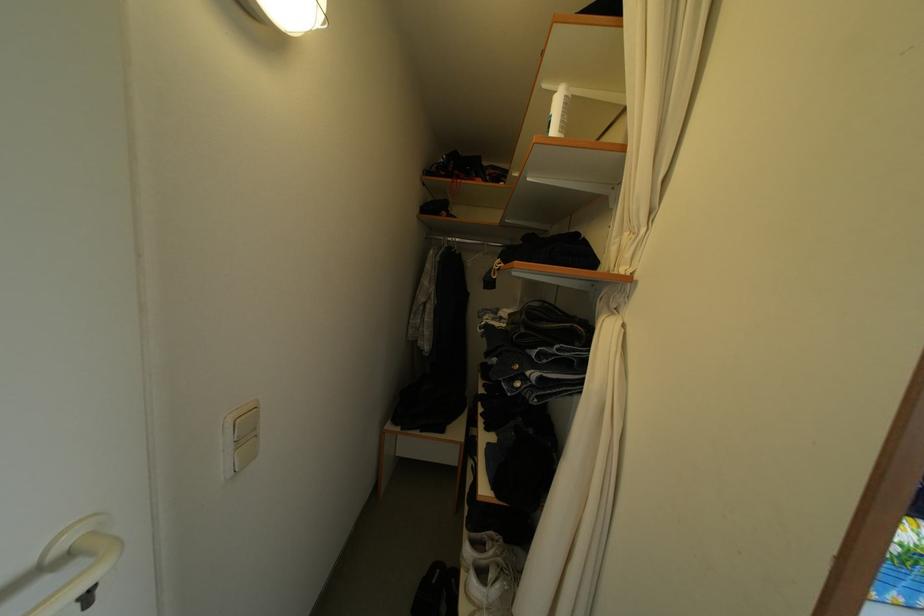
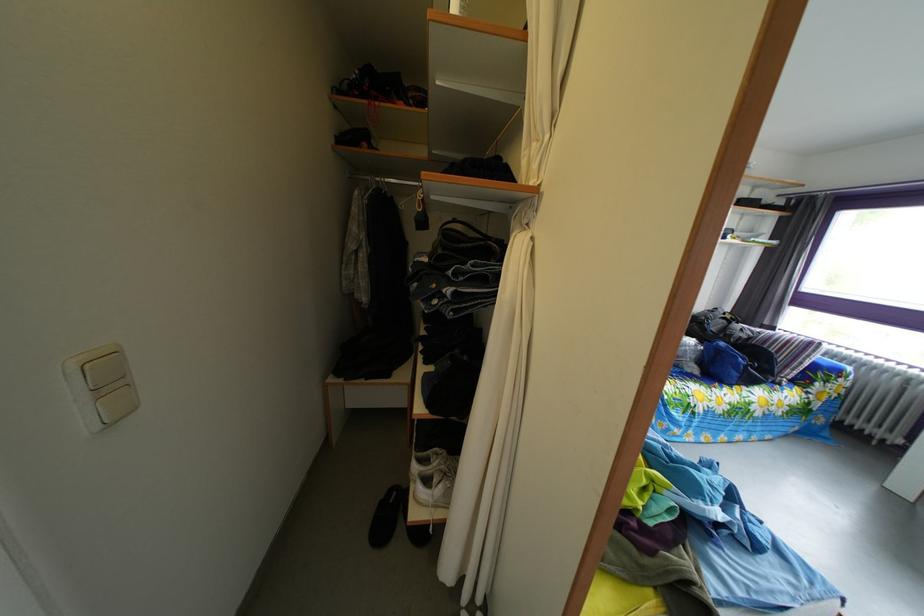
Question: Which direction would the cameraman need to move to produce the second image? Reply with the corresponding letter.

Choices:
 (A) Left
 (B) Right
 (C) Forward
 (D) Backward

Answer: (B)